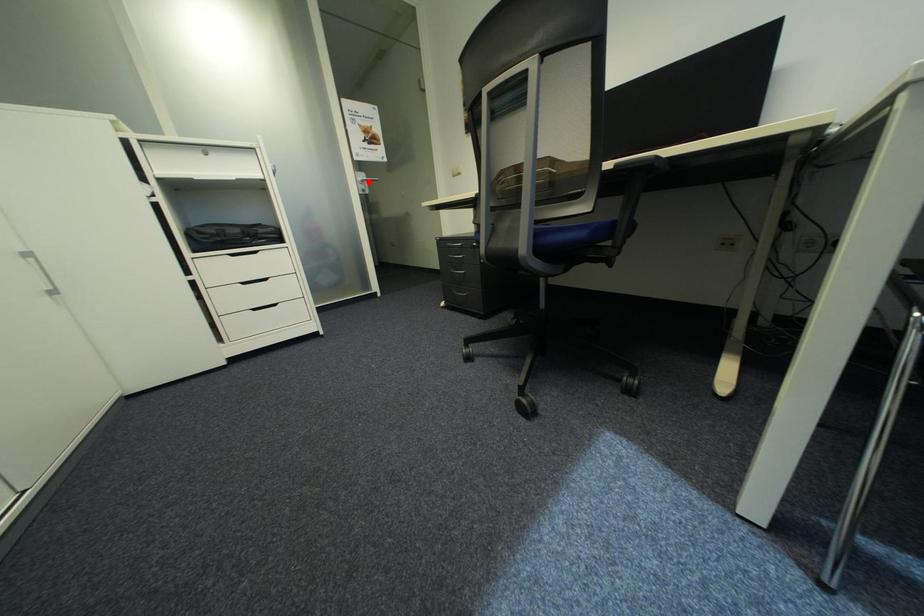
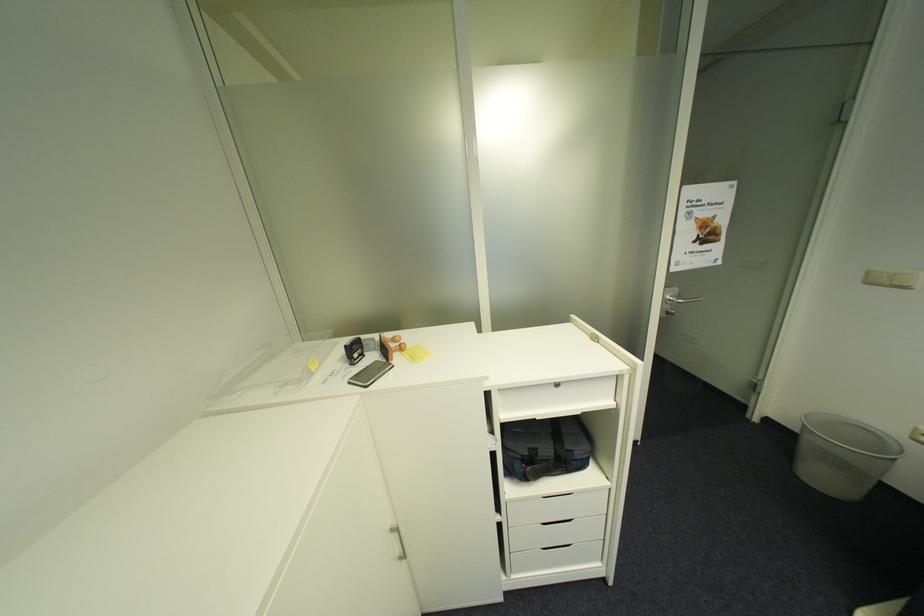
The point at the highlighted location is marked in the first image. Where is the corresponding point in the second image?

(676, 301)